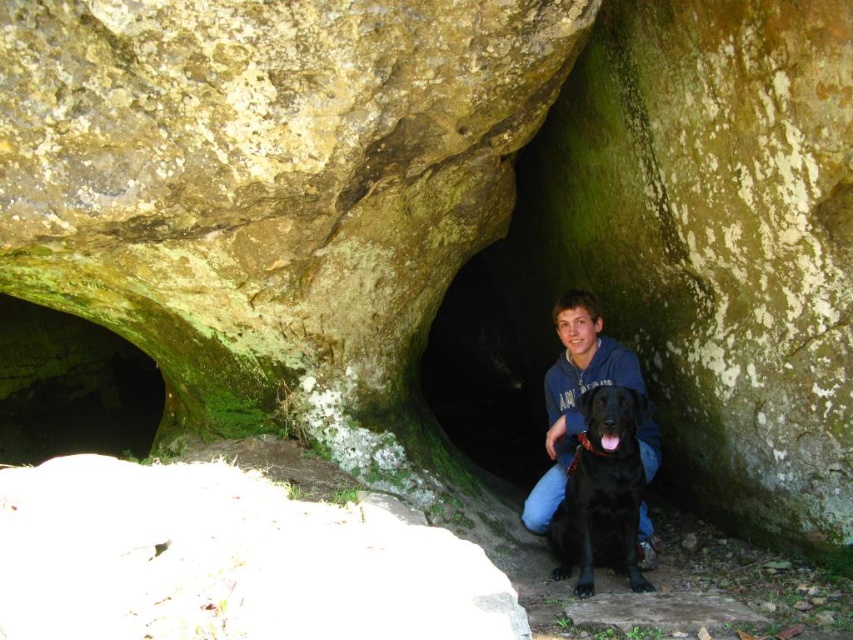
You are standing at the entrance of the cave and want to take a photo of the shiny black dog at center. Based on its position, where should you aim your camera?

The shiny black dog at center is located at point coordinates [602,492], so you should aim your camera towards those coordinates to capture the dog in the frame.

You are planning to take a photo of the green mossy cave at upper left and the shiny black dog at center. Which object should be positioned closer to the camera to ensure both are in focus?

The green mossy cave at upper left is taller than the shiny black dog at center, so positioning the shiny black dog at center closer to the camera would help keep both in focus as the cave is taller and might require a wider depth of field.